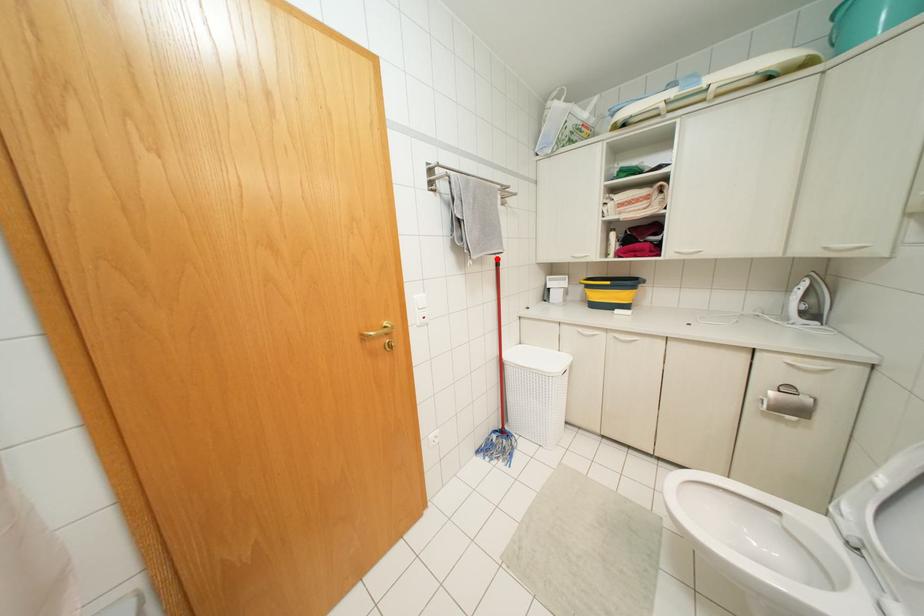
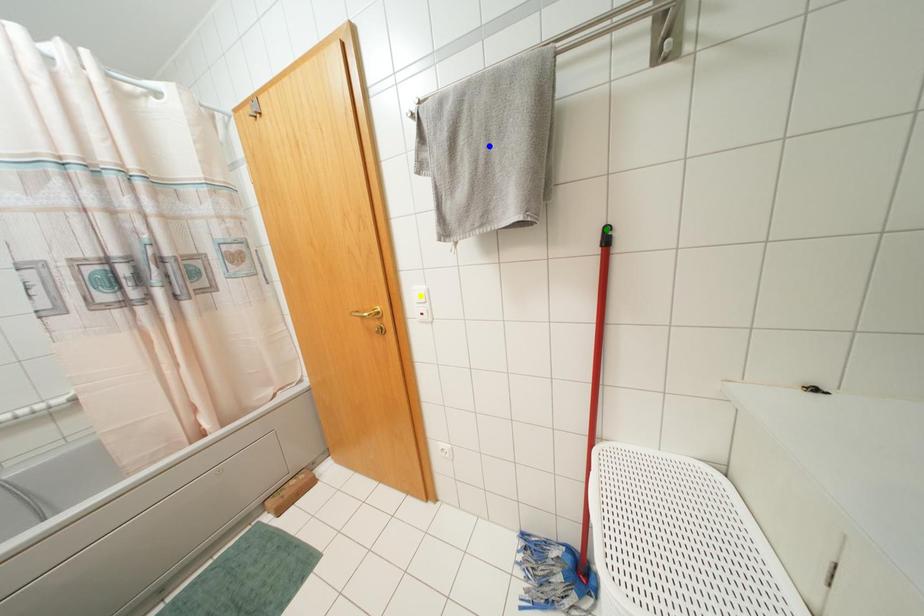
Question: I am providing you with two images of the same scene from different viewpoints. A red point is marked on the first image. You are given multiple points on the second image. Which point in image 2 is actually the same real-world point as the red point in image 1?

Choices:
 (A) blue point
 (B) green point
 (C) yellow point

Answer: (B)